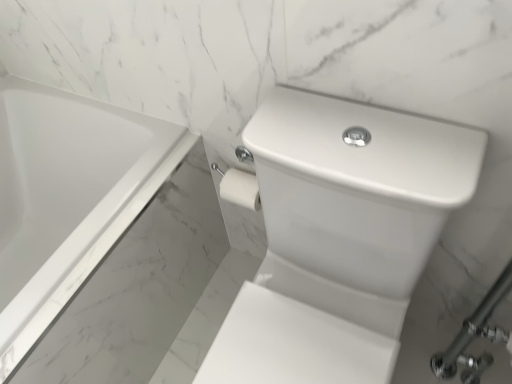
Question: In terms of height, does white glossy sink at center look taller or shorter compared to white glossy bathtub at upper left?

Choices:
 (A) short
 (B) tall

Answer: (B)

Question: From a real-world perspective, is white glossy sink at center above or below white glossy bathtub at upper left?

Choices:
 (A) below
 (B) above

Answer: (B)

Question: Is point (359, 152) positioned closer to the camera than point (129, 160)?

Choices:
 (A) farther
 (B) closer

Answer: (B)

Question: From the image's perspective, relative to white glossy sink at center, is white glossy bathtub at upper left above or below?

Choices:
 (A) below
 (B) above

Answer: (B)

Question: Is white glossy bathtub at upper left taller or shorter than white glossy sink at center?

Choices:
 (A) tall
 (B) short

Answer: (B)

Question: Looking at the image, does white glossy bathtub at upper left seem bigger or smaller compared to white glossy sink at center?

Choices:
 (A) big
 (B) small

Answer: (A)

Question: In the image, is white glossy bathtub at upper left on the left side or the right side of white glossy sink at center?

Choices:
 (A) left
 (B) right

Answer: (A)